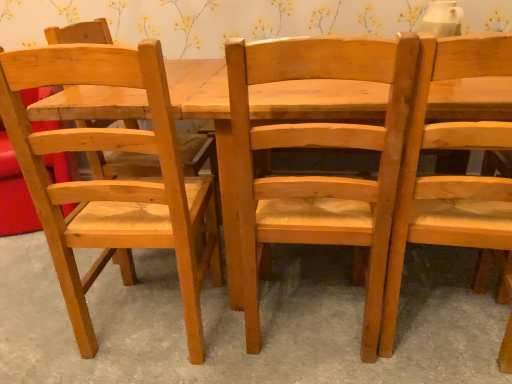
Where is `free space above natural wood chair at center (from a real-world perspective)`? The height and width of the screenshot is (384, 512). free space above natural wood chair at center (from a real-world perspective) is located at coordinates (170, 299).